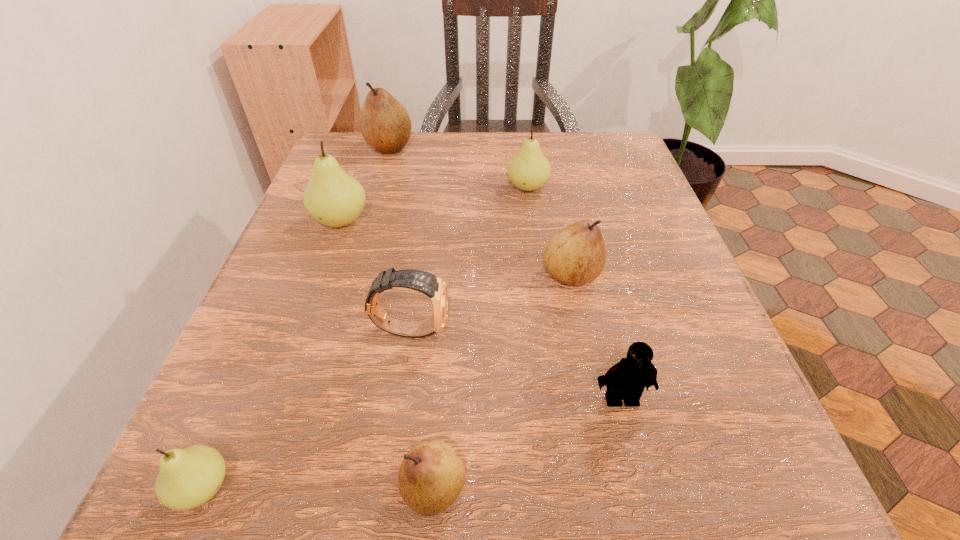
You are a GUI agent. You are given a task and a screenshot of the screen. Output one action in this format:
    pyautogui.click(x=<x>, y=<y>)
    Task: Click on the Lego
    This screenshot has width=960, height=540.
    Given the screenshot: What is the action you would take?
    pyautogui.click(x=626, y=380)

What are the coordinates of `black Lego` in the screenshot? It's located at (626, 380).

The image size is (960, 540). In order to click on the smallest green pear in this screenshot , I will do `click(187, 478)`.

Where is `the smallest brown pear`? The image size is (960, 540). the smallest brown pear is located at coordinates (432, 475).

Find the location of a particular element. The width and height of the screenshot is (960, 540). the nearest brown pear is located at coordinates (432, 475).

Find the location of a particular element. The width and height of the screenshot is (960, 540). free region located on the front of the biggest brown pear is located at coordinates (356, 259).

Image resolution: width=960 pixels, height=540 pixels. What are the coordinates of `vacant space situated on the right of the second nearest green pear` in the screenshot? It's located at (524, 221).

Image resolution: width=960 pixels, height=540 pixels. Find the location of `free spot located on the front of the rightmost green pear`. free spot located on the front of the rightmost green pear is located at coordinates tap(548, 340).

Locate an element on the screen. This screenshot has width=960, height=540. vacant space situated 0.050m on the front of the third nearest pear is located at coordinates (581, 319).

The height and width of the screenshot is (540, 960). Find the location of `vacant space situated 0.390m on the face of the fourth nearest object`. vacant space situated 0.390m on the face of the fourth nearest object is located at coordinates (705, 328).